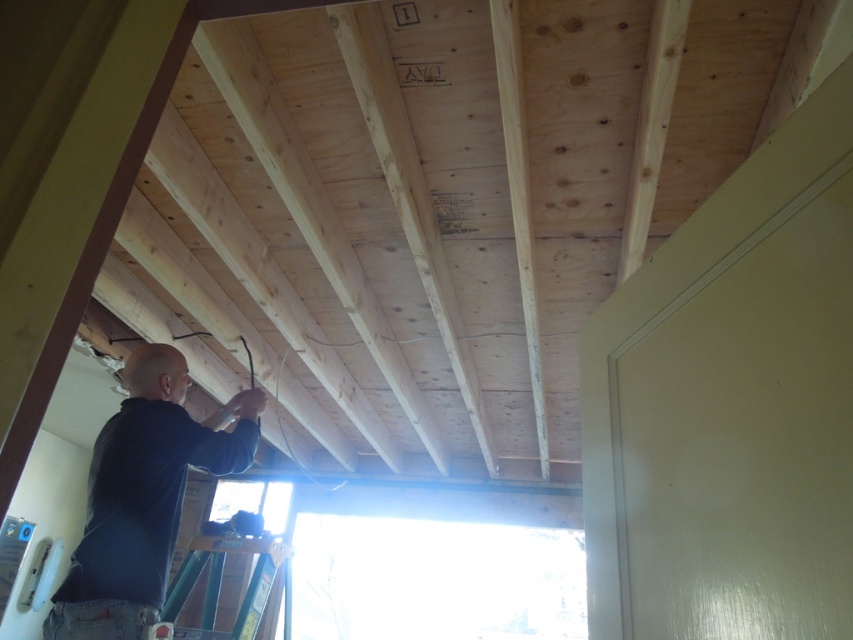
Question: Is dark blue shirt at lower left positioned before green metallic ladder at lower left?

Choices:
 (A) no
 (B) yes

Answer: (B)

Question: Which object appears farthest from the camera in this image?

Choices:
 (A) dark blue shirt at lower left
 (B) green metallic ladder at lower left

Answer: (B)

Question: Which object appears farthest from the camera in this image?

Choices:
 (A) green metallic ladder at lower left
 (B) dark blue shirt at lower left

Answer: (A)

Question: Does dark blue shirt at lower left appear under green metallic ladder at lower left?

Choices:
 (A) yes
 (B) no

Answer: (B)

Question: Is dark blue shirt at lower left further to camera compared to green metallic ladder at lower left?

Choices:
 (A) yes
 (B) no

Answer: (B)